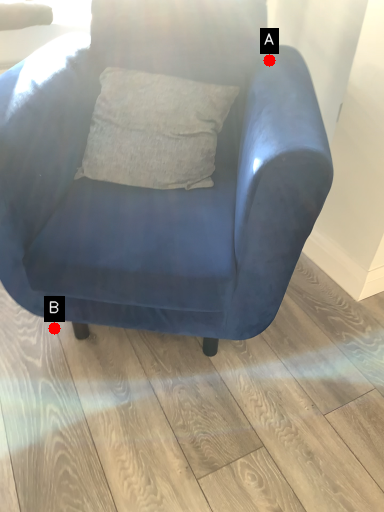
Question: Two points are circled on the image, labeled by A and B beside each circle. Which of the following is the farthest from the observer?

Choices:
 (A) A is further
 (B) B is further

Answer: (B)